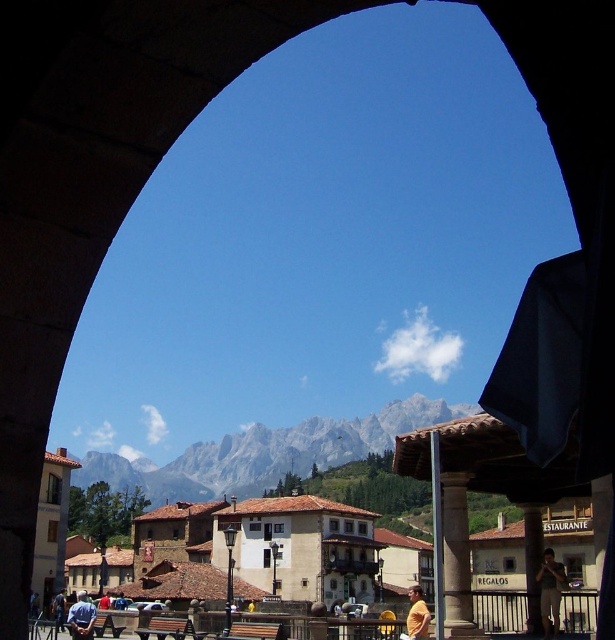
You are a photographer positioned at the center of the scene. You notice two shirts in the image, the yellow matte shirt at lower center and the blue shirt at lower left. Which shirt is positioned lower in the frame?

The yellow matte shirt at lower center is positioned lower than the blue shirt at lower left.

You are a photographer standing at the arched opening in the image. You want to capture a photo that includes both the rugged stone mountain at center and the blue shirt at lower left. Which object should you focus on first if you want to ensure both are in sharp focus?

The rugged stone mountain at center has a greater height compared to the blue shirt at lower left, so you should focus on the rugged stone mountain at center first to ensure both are in sharp focus.

You are packing for a trip and have both the dark brown leather jacket at lower right and the blue fabric shirt at lower left in your suitcase. If you need to place them side by side on a narrow shelf, which item should you place first to ensure both fit?

The dark brown leather jacket at lower right has a smaller width than the blue fabric shirt at lower left, so you should place the blue fabric shirt at lower left first to accommodate its larger size, allowing the jacket to fit alongside.